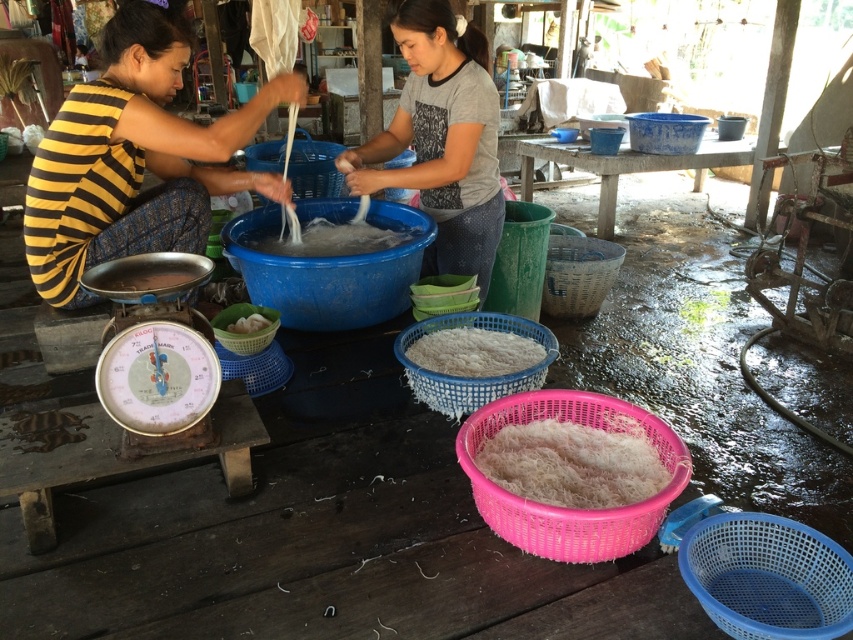
How distant is gray matte shirt at center from metallic scale at lower left?

gray matte shirt at center and metallic scale at lower left are 3.87 feet apart from each other.

Does gray matte shirt at center appear over metallic scale at lower left?

Indeed, gray matte shirt at center is positioned over metallic scale at lower left.

Is point (386, 145) more distant than point (189, 275)?

Yes, point (386, 145) is behind point (189, 275).

This screenshot has height=640, width=853. I want to click on gray matte shirt at center, so click(440, 140).

Between point (398, 118) and point (527, 362), which one is positioned behind?

Point (398, 118)

Can you confirm if gray matte shirt at center is positioned below white fluffy rice at center?

Incorrect, gray matte shirt at center is not positioned below white fluffy rice at center.

Which is behind, point (468, 221) or point (413, 348)?

Point (468, 221)

You are a GUI agent. You are given a task and a screenshot of the screen. Output one action in this format:
    pyautogui.click(x=<x>, y=<y>)
    Task: Click on the gray matte shirt at center
    This screenshot has width=853, height=640.
    Given the screenshot: What is the action you would take?
    click(440, 140)

Consider the image. Is yellow striped fabric at left bigger than white stringy noodles at center?

Yes, yellow striped fabric at left is bigger than white stringy noodles at center.

Which is behind, point (65, 294) or point (321, 237)?

The point (321, 237) is behind.

The image size is (853, 640). I want to click on yellow striped fabric at left, so click(135, 157).